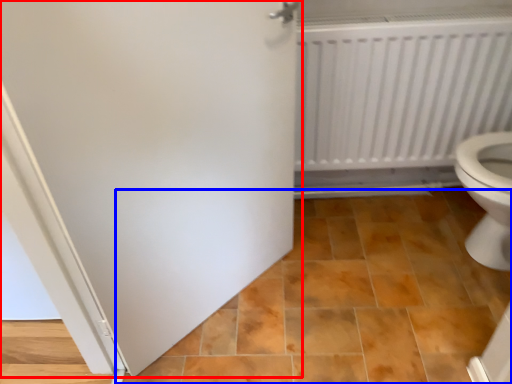
Question: Among these objects, which one is farthest to the camera, door (highlighted by a red box) or ceramic tile (highlighted by a blue box)?

Choices:
 (A) door
 (B) ceramic tile

Answer: (B)